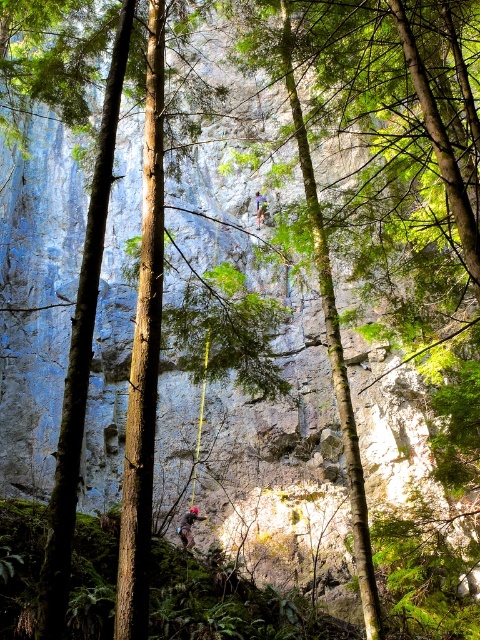
Does red climbing harness at center appear on the right side of blue fabric climbing harness at center?

Incorrect, red climbing harness at center is not on the right side of blue fabric climbing harness at center.

Can you confirm if red climbing harness at center is wider than blue fabric climbing harness at center?

Yes, red climbing harness at center is wider than blue fabric climbing harness at center.

Describe the element at coordinates (188, 525) in the screenshot. I see `red climbing harness at center` at that location.

Locate an element on the screen. The height and width of the screenshot is (640, 480). red climbing harness at center is located at coordinates (188, 525).